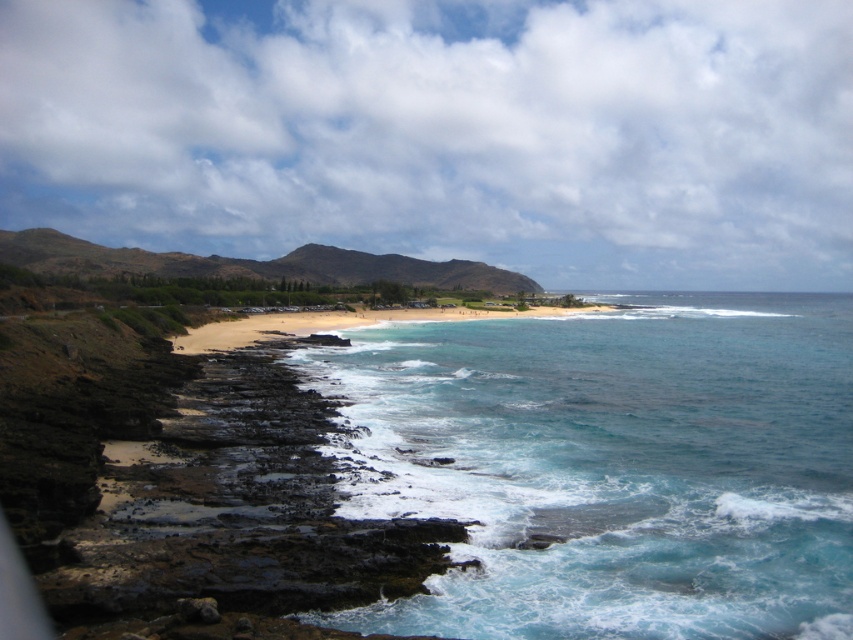
Question: Which object is positioned closest to the dark brown rocky cliffs at lower left?

Choices:
 (A) golden sand beach at center
 (B) clear blue water at center

Answer: (B)

Question: Estimate the real-world distances between objects in this image. Which object is farther from the clear blue water at center?

Choices:
 (A) golden sand beach at center
 (B) dark brown rocky cliffs at lower left

Answer: (A)

Question: Does dark brown rocky cliffs at lower left appear over golden sand beach at center?

Choices:
 (A) no
 (B) yes

Answer: (A)

Question: Does clear blue water at center have a greater width compared to dark brown rocky cliffs at lower left?

Choices:
 (A) no
 (B) yes

Answer: (B)

Question: Is the position of clear blue water at center less distant than that of golden sand beach at center?

Choices:
 (A) no
 (B) yes

Answer: (B)

Question: Which point is farther to the camera?

Choices:
 (A) golden sand beach at center
 (B) clear blue water at center

Answer: (A)